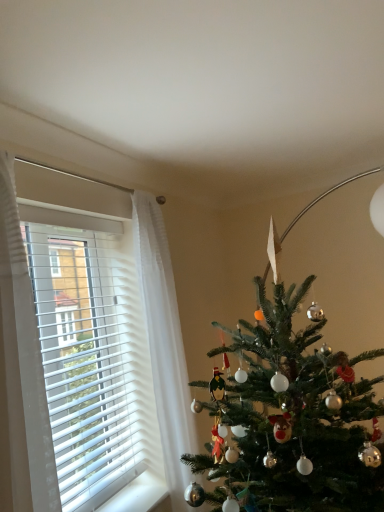
Question: From the image's perspective, would you say white blinds at left is shown under green matte christmas tree at center?

Choices:
 (A) yes
 (B) no

Answer: (B)

Question: Does white blinds at left touch green matte christmas tree at center?

Choices:
 (A) yes
 (B) no

Answer: (B)

Question: Considering the relative positions of white blinds at left and green matte christmas tree at center in the image provided, is white blinds at left behind green matte christmas tree at center?

Choices:
 (A) yes
 (B) no

Answer: (B)

Question: From the image's perspective, is white blinds at left on green matte christmas tree at center?

Choices:
 (A) yes
 (B) no

Answer: (A)

Question: Can you confirm if white blinds at left is taller than green matte christmas tree at center?

Choices:
 (A) no
 (B) yes

Answer: (A)

Question: From a real-world perspective, is white blinds at left beneath green matte christmas tree at center?

Choices:
 (A) no
 (B) yes

Answer: (A)

Question: From the image's perspective, is white blinds at left located above green matte christmas tree at right?

Choices:
 (A) no
 (B) yes

Answer: (B)

Question: Is white blinds at left smaller than green matte christmas tree at right?

Choices:
 (A) yes
 (B) no

Answer: (A)

Question: Can you confirm if white blinds at left is taller than green matte christmas tree at right?

Choices:
 (A) yes
 (B) no

Answer: (B)

Question: Can you confirm if white blinds at left is positioned to the right of green matte christmas tree at right?

Choices:
 (A) yes
 (B) no

Answer: (B)

Question: Considering the relative sizes of white blinds at left and green matte christmas tree at right in the image provided, is white blinds at left thinner than green matte christmas tree at right?

Choices:
 (A) yes
 (B) no

Answer: (A)

Question: From a real-world perspective, is white blinds at left below green matte christmas tree at right?

Choices:
 (A) yes
 (B) no

Answer: (B)

Question: Is green matte christmas tree at center shorter than green matte christmas tree at right?

Choices:
 (A) no
 (B) yes

Answer: (B)